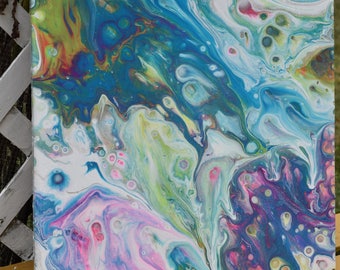
Where is `painting`? painting is located at coordinates (36, 179).